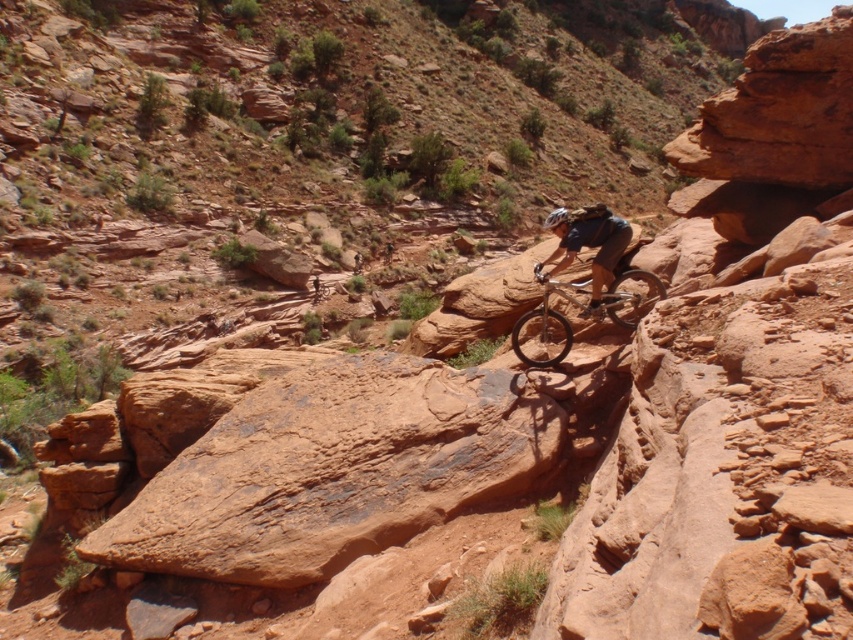
Question: Can you confirm if silver metallic mountain bike at center is positioned to the left of shiny black helmet at center?

Choices:
 (A) no
 (B) yes

Answer: (B)

Question: Does silver metallic mountain bike at center appear on the right side of shiny black helmet at center?

Choices:
 (A) yes
 (B) no

Answer: (B)

Question: Which point is farther to the camera?

Choices:
 (A) (560, 289)
 (B) (593, 221)

Answer: (A)

Question: Can you confirm if silver metallic mountain bike at center is positioned to the left of shiny black helmet at center?

Choices:
 (A) yes
 (B) no

Answer: (A)